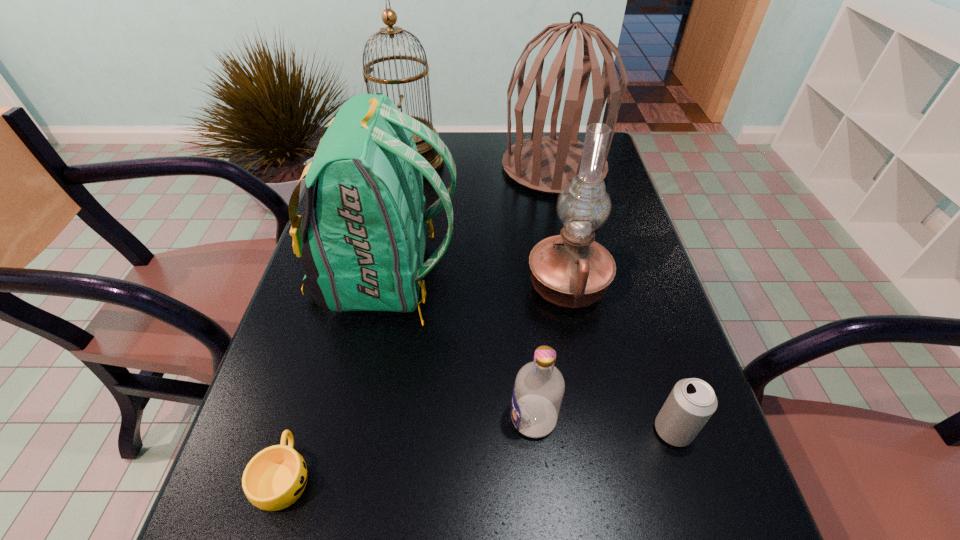
Where is `free spot located 0.110m on the front of the oil lamp`? free spot located 0.110m on the front of the oil lamp is located at coordinates (582, 362).

Locate an element on the screen. The height and width of the screenshot is (540, 960). vacant space positioned 0.060m on the label of the vodka is located at coordinates (476, 418).

I want to click on vacant region located on the label of the vodka, so click(296, 418).

You are a GUI agent. You are given a task and a screenshot of the screen. Output one action in this format:
    pyautogui.click(x=<x>, y=<y>)
    Task: Click on the blank area located on the label of the vodka
    
    Given the screenshot: What is the action you would take?
    pyautogui.click(x=364, y=418)

I want to click on free spot located 0.190m on the back of the sixth tallest object, so click(640, 328).

I want to click on free point located 0.060m on the back of the shortest object, so click(305, 408).

Image resolution: width=960 pixels, height=540 pixels. What are the coordinates of `birdcage located in the left edge section of the desktop` in the screenshot? It's located at (389, 17).

I want to click on backpack present at the left edge, so click(364, 250).

Find the location of a particular element. This screenshot has height=540, width=960. cup that is at the left edge is located at coordinates pyautogui.click(x=275, y=477).

Identify the location of birdcage that is at the right edge. (546, 164).